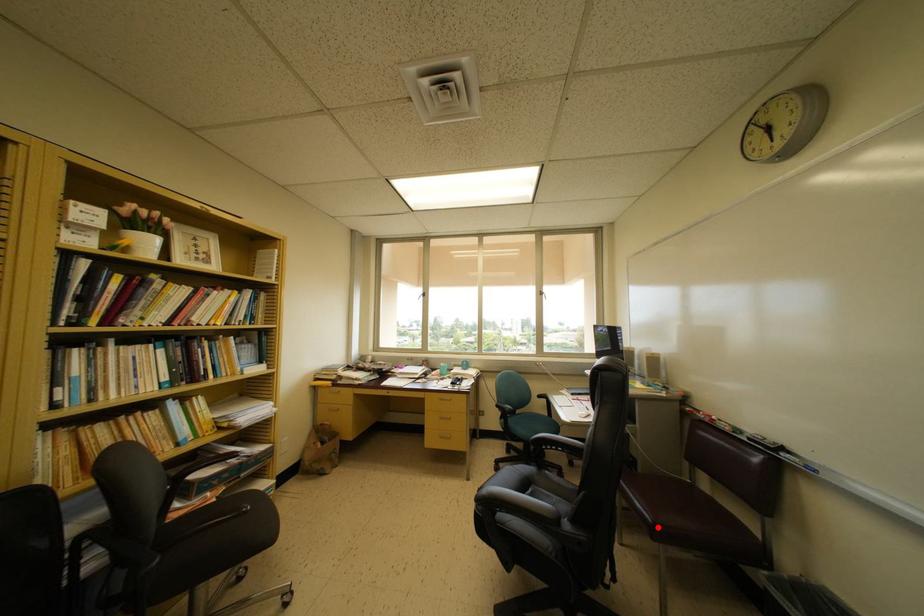
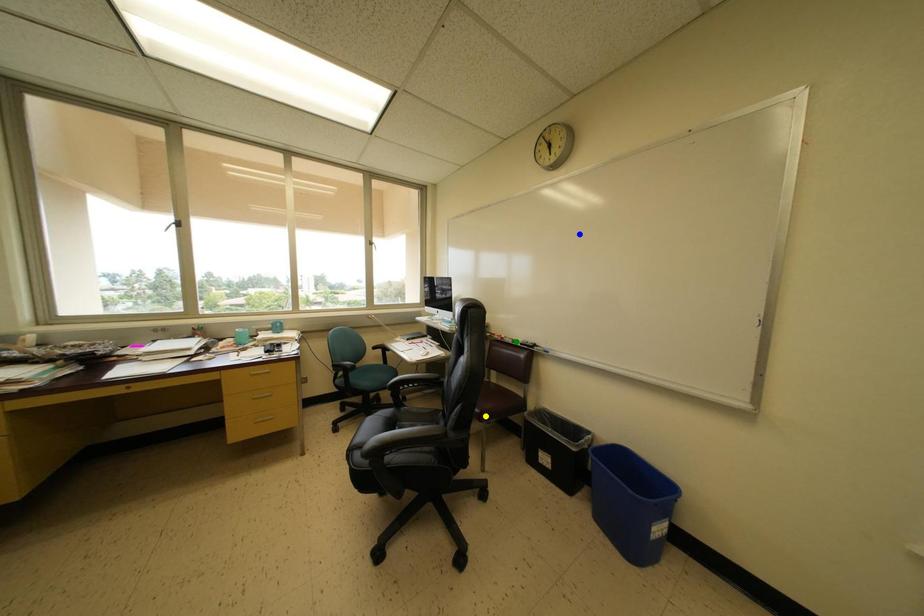
Question: I am providing you with two images of the same scene from different viewpoints. A red point is marked on the first image. You are given multiple points on the second image. In image 2, which mark is for the same physical point as the one in image 1?

Choices:
 (A) green point
 (B) blue point
 (C) yellow point

Answer: (C)